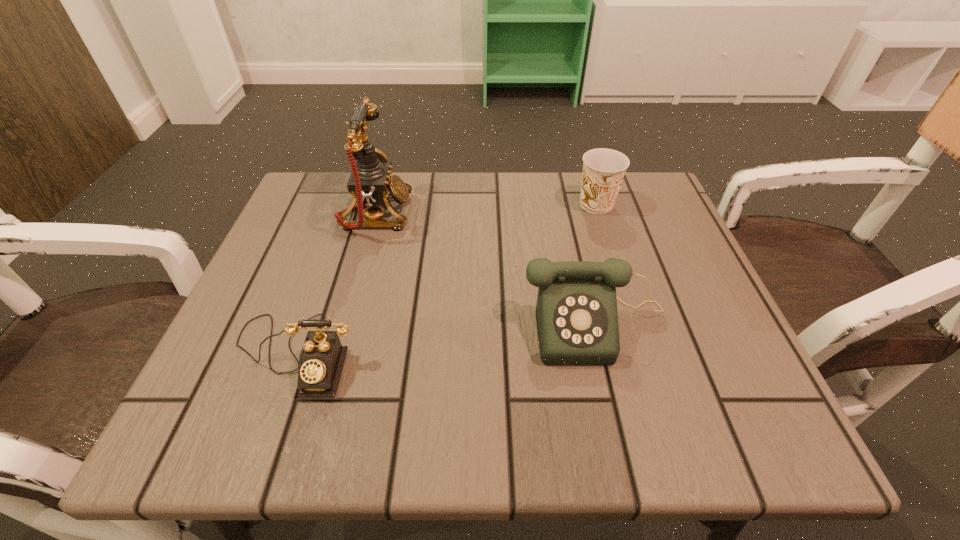
In the image, there is a desktop. Find the location of `vacant space at the far left corner`. vacant space at the far left corner is located at coordinates (307, 194).

The width and height of the screenshot is (960, 540). In the image, there is a desktop. What are the coordinates of `vacant area at the near left corner` in the screenshot? It's located at (289, 444).

In the image, there is a desktop. Identify the location of free region at the far right corner. The width and height of the screenshot is (960, 540). (664, 228).

Find the location of a particular element. The height and width of the screenshot is (540, 960). free space between the shortest telephone and the farthest telephone is located at coordinates (336, 284).

This screenshot has width=960, height=540. What are the coordinates of `free space between the farthest telephone and the second shortest telephone` in the screenshot? It's located at (486, 269).

Find the location of a particular element. The image size is (960, 540). free space between the rightmost telephone and the shortest telephone is located at coordinates (445, 339).

Where is `free area in between the second tallest telephone and the shortest object`? The height and width of the screenshot is (540, 960). free area in between the second tallest telephone and the shortest object is located at coordinates (445, 339).

Where is `free space between the second shortest telephone and the shortest telephone`? This screenshot has height=540, width=960. free space between the second shortest telephone and the shortest telephone is located at coordinates (445, 339).

The height and width of the screenshot is (540, 960). In order to click on empty space between the farthest telephone and the Dixie cup in this screenshot , I will do `click(486, 210)`.

Locate an element on the screen. The width and height of the screenshot is (960, 540). vacant space that is in between the tallest object and the shortest object is located at coordinates (336, 284).